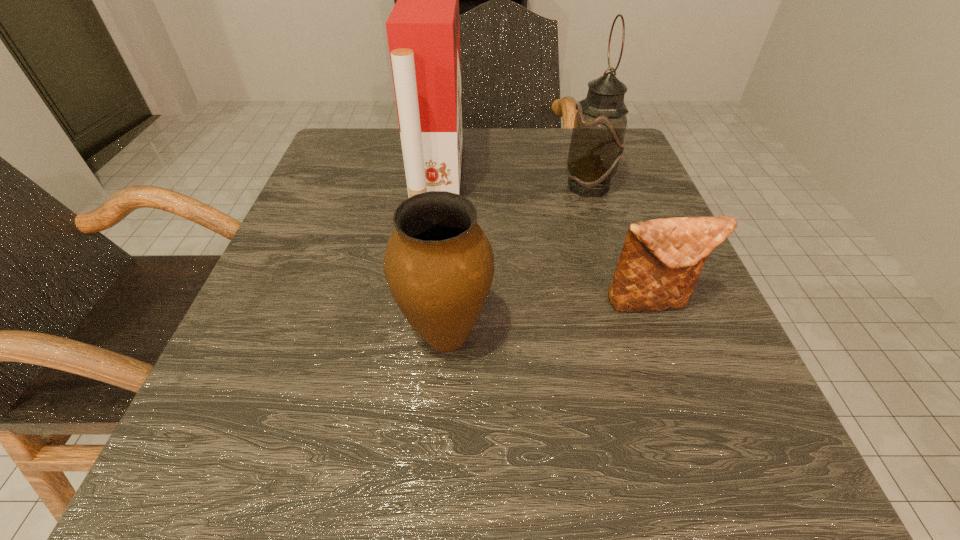
Locate an element on the screen. cigarette case is located at coordinates (423, 30).

Where is `oil lamp`? The image size is (960, 540). oil lamp is located at coordinates (597, 143).

The height and width of the screenshot is (540, 960). What are the coordinates of `urn` in the screenshot? It's located at (439, 264).

Where is `clutch bag`? clutch bag is located at coordinates (661, 260).

Find the location of a particular element. This screenshot has height=540, width=960. free location located 0.360m on the front-facing side of the cigarette case is located at coordinates (640, 180).

This screenshot has width=960, height=540. In order to click on free space located 0.050m on the left of the oil lamp in this screenshot , I will do [539, 186].

The height and width of the screenshot is (540, 960). Identify the location of vacant space located 0.060m on the back of the second shortest object. (450, 272).

At what (x,y) coordinates should I click in order to perform the action: click on vacant space located 0.250m on the open side of the shortest object. Please return your answer as a coordinate pair (x, y). Image resolution: width=960 pixels, height=540 pixels. Looking at the image, I should click on pos(726,508).

The image size is (960, 540). I want to click on cigarette case situated at the far edge, so click(423, 30).

Locate an element on the screen. oil lamp located at the far edge is located at coordinates (597, 143).